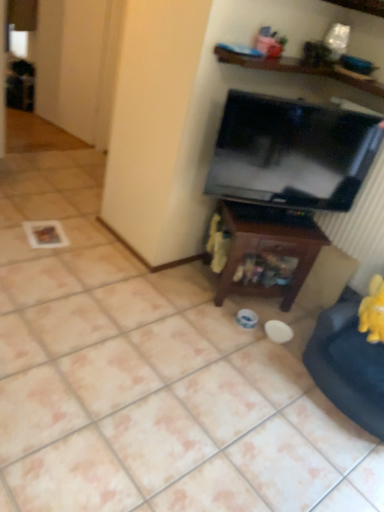
You are a GUI agent. You are given a task and a screenshot of the screen. Output one action in this format:
    pyautogui.click(x=<x>, y=<y>)
    Task: Click on the free location in front of velvet yellow swivel chair at lower right
    Image resolution: width=384 pixels, height=512 pixels.
    Given the screenshot: What is the action you would take?
    [326, 452]